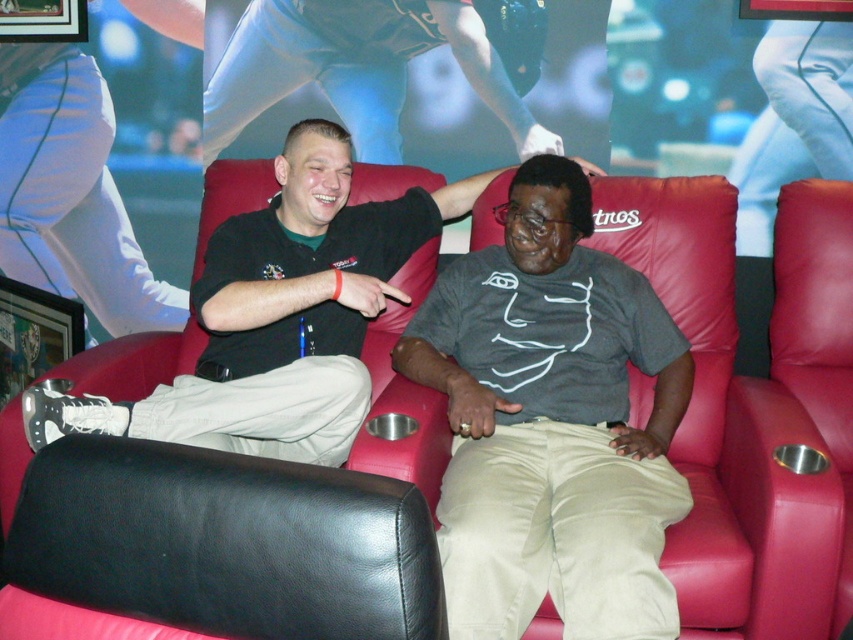
Question: In this image, where is leather armchair at center located relative to khaki cotton pants at center?

Choices:
 (A) left
 (B) right

Answer: (B)

Question: Observing the image, what is the correct spatial positioning of leather armchair at center in reference to khaki cotton pants at center?

Choices:
 (A) below
 (B) above

Answer: (B)

Question: Which point is closer to the camera taking this photo?

Choices:
 (A) (553, 220)
 (B) (383, 49)

Answer: (A)

Question: Which of the following is the farthest from the observer?

Choices:
 (A) (202, 298)
 (B) (392, 86)
 (C) (514, 272)

Answer: (B)

Question: Can you confirm if black matte shirt at center is smaller than matte black shirt at upper center?

Choices:
 (A) yes
 (B) no

Answer: (B)

Question: Among these objects, which one is nearest to the camera?

Choices:
 (A) leather armchair at center
 (B) khaki cotton pants at center

Answer: (B)